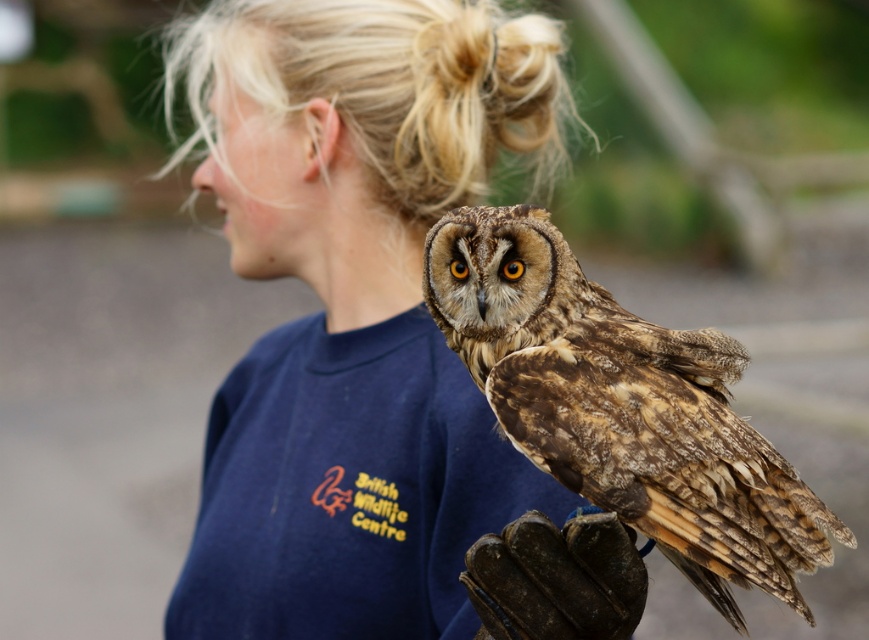
Question: Can you confirm if blue cotton shirt at center is positioned below brown speckled owl at center?

Choices:
 (A) yes
 (B) no

Answer: (B)

Question: Which object appears closest to the camera in this image?

Choices:
 (A) blue cotton shirt at center
 (B) brown speckled owl at center

Answer: (B)

Question: Can you confirm if brown speckled owl at center is smaller than leather glove at lower right?

Choices:
 (A) yes
 (B) no

Answer: (B)

Question: Can you confirm if brown speckled owl at center is wider than leather glove at lower right?

Choices:
 (A) no
 (B) yes

Answer: (B)

Question: Estimate the real-world distances between objects in this image. Which object is farther from the brown speckled owl at center?

Choices:
 (A) leather glove at lower right
 (B) blue cotton shirt at center

Answer: (B)

Question: Estimate the real-world distances between objects in this image. Which object is farther from the leather glove at lower right?

Choices:
 (A) brown speckled owl at center
 (B) blue cotton shirt at center

Answer: (B)